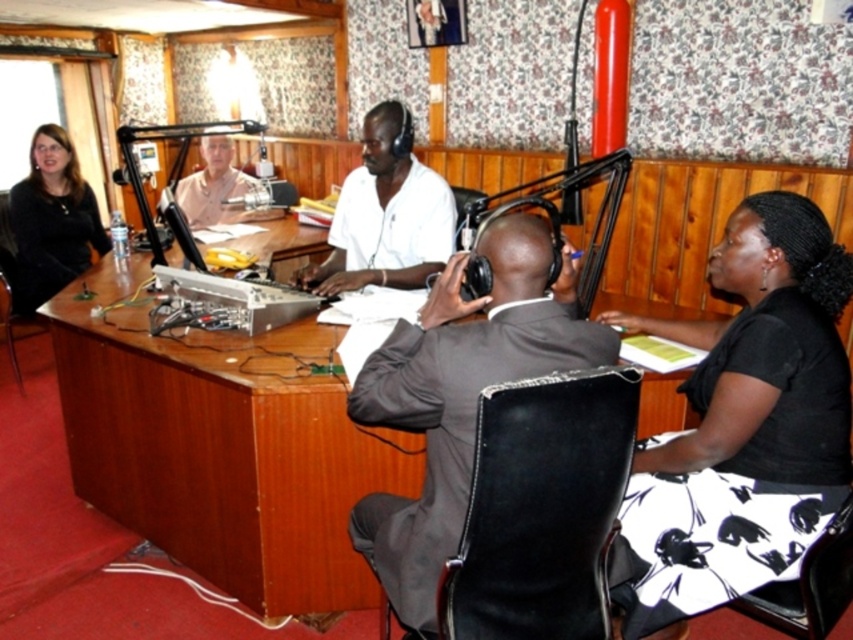
You are a guest entering the studio and need to sit next to the dark gray suit at center. Which direction should you move from the matte black jacket at left?

The dark gray suit at center is to the right of the matte black jacket at left, so you should move to the right from the matte black jacket at left to sit next to the dark gray suit at center.

In the radio studio scene, there are two men wearing dark gray suit at center and matte black jacket at left. Which one is positioned lower in the image?

The dark gray suit at center is positioned lower than the matte black jacket at left in the image.

Please describe the position of the dark gray suit at center in terms of coordinates within the image frame. The image frame has a coordinate system where the bottom left corner is the origin point.

The dark gray suit at center is located at coordinates approximately 0.620 on the x axis and 0.542 on the y axis within the image frame.